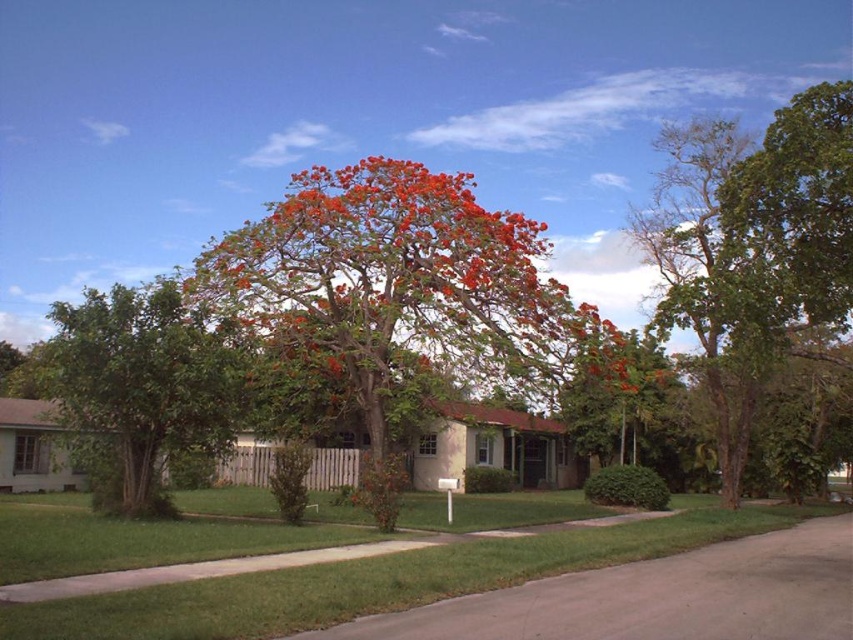
You are planning to install a new garden feature in the suburban scene. You have two options for placement based on the objects present. Which object, the green grass at center or the green leafy tree at center, would you choose to place a small decorative garden statue that requires a space of 1 meter in diameter?

The green grass at center has a smaller size compared to the green leafy tree at center, so the garden statue requiring 1 meter in diameter would fit better on the green grass at center since it is smaller and likely has enough space.

You are standing in front of the suburban house and notice two points marked on the image. The first point is at coordinate point (791, 134) and the second at point (796, 513). Which point is closer to your current position?

Point (791, 134) is closer to the camera than point (796, 513), so the first point is closer to your current position.